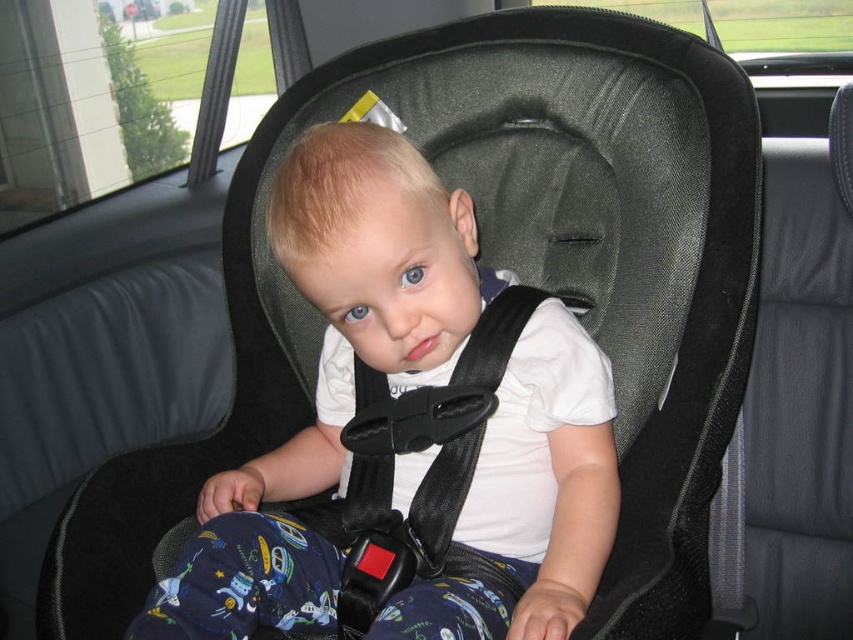
Who is taller, white matte shirt at center or black fabric strap at center?

white matte shirt at center

Locate an element on the screen. Image resolution: width=853 pixels, height=640 pixels. white matte shirt at center is located at coordinates (329, 369).

The image size is (853, 640). What do you see at coordinates (329, 369) in the screenshot?
I see `white matte shirt at center` at bounding box center [329, 369].

Identify the location of white matte shirt at center. (329, 369).